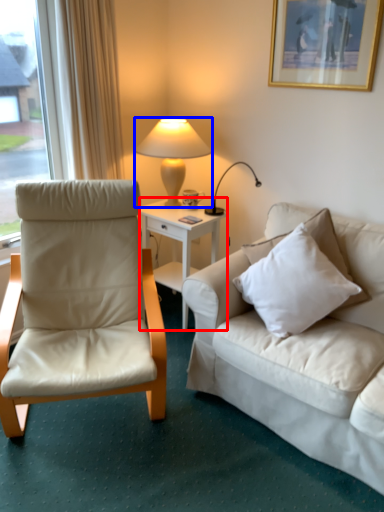
Question: Which object is closer to the camera taking this photo, desk (highlighted by a red box) or lamp (highlighted by a blue box)?

Choices:
 (A) desk
 (B) lamp

Answer: (B)